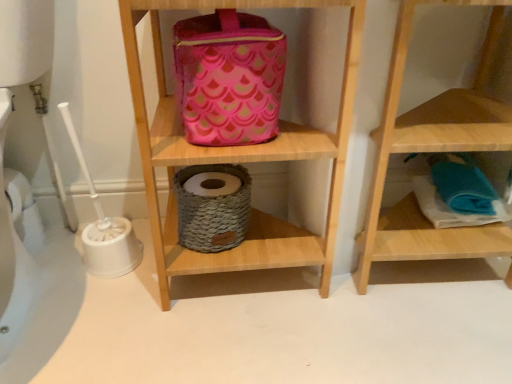
Where is `pink fabric pouch at upper center`? pink fabric pouch at upper center is located at coordinates (229, 78).

Image resolution: width=512 pixels, height=384 pixels. Identify the location of pink fabric bag at upper center, the 2th shelf viewed from the right. (237, 156).

In the scene shown: What is the approximate width of pink fabric bag at upper center, the 2th shelf viewed from the right?

44.73 centimeters.

Locate an element on the screen. This screenshot has height=384, width=512. wooden towel at lower right, the second shelf from the left is located at coordinates (434, 151).

Is wooden towel at lower right, the second shelf from the left, next to pink fabric pouch at upper center and touching it?

No, wooden towel at lower right, the second shelf from the left, is not with pink fabric pouch at upper center.

Which object is thinner, wooden towel at lower right, acting as the first shelf starting from the right, or pink fabric pouch at upper center?

Thinner between the two is pink fabric pouch at upper center.

From a real-world perspective, is wooden towel at lower right, acting as the first shelf starting from the right, over pink fabric pouch at upper center?

No, from a real-world perspective, wooden towel at lower right, acting as the first shelf starting from the right, is not over pink fabric pouch at upper center

Between wooden towel at lower right, acting as the first shelf starting from the right, and pink fabric pouch at upper center, which one has smaller size?

pink fabric pouch at upper center.

The width and height of the screenshot is (512, 384). In order to click on pouch lying on the left of wooden towel at lower right, acting as the first shelf starting from the right in this screenshot , I will do `click(229, 78)`.

From the image's perspective, between pink fabric pouch at upper center and wooden towel at lower right, the second shelf from the left, which one is located above?

From the image's view, pink fabric pouch at upper center is above.

Does pink fabric pouch at upper center touch wooden towel at lower right, acting as the first shelf starting from the right?

pink fabric pouch at upper center is not next to wooden towel at lower right, acting as the first shelf starting from the right, and they're not touching.

Between point (242, 18) and point (464, 112), which one is positioned in front?

The point (242, 18) is more forward.

Is pink fabric pouch at upper center not within pink fabric bag at upper center, arranged as the 1th shelf when viewed from the left?

Actually, pink fabric pouch at upper center is within pink fabric bag at upper center, arranged as the 1th shelf when viewed from the left.

How many degrees apart are the facing directions of pink fabric pouch at upper center and pink fabric bag at upper center, arranged as the 1th shelf when viewed from the left?

They differ by 0.455 degrees in their facing directions.

Is pink fabric pouch at upper center shorter than pink fabric bag at upper center, the 2th shelf viewed from the right?

Indeed, pink fabric pouch at upper center has a lesser height compared to pink fabric bag at upper center, the 2th shelf viewed from the right.

Is wooden towel at lower right, the second shelf from the left, positioned far away from pink fabric bag at upper center, the 2th shelf viewed from the right?

Actually, wooden towel at lower right, the second shelf from the left, and pink fabric bag at upper center, the 2th shelf viewed from the right, are a little close together.

Considering the positions of point (497, 253) and point (344, 0), is point (497, 253) closer or farther from the camera than point (344, 0)?

Point (497, 253) is positioned farther from the camera compared to point (344, 0).

From a real-world perspective, is wooden towel at lower right, the second shelf from the left, on top of pink fabric bag at upper center, the 2th shelf viewed from the right?

No, from a real-world perspective, wooden towel at lower right, the second shelf from the left, is not on top of pink fabric bag at upper center, the 2th shelf viewed from the right.

Considering the positions of objects wooden towel at lower right, the second shelf from the left, and pink fabric bag at upper center, the 2th shelf viewed from the right, in the image provided, who is more to the left, wooden towel at lower right, the second shelf from the left, or pink fabric bag at upper center, the 2th shelf viewed from the right,?

Positioned to the left is pink fabric bag at upper center, the 2th shelf viewed from the right.

Between pink fabric bag at upper center, arranged as the 1th shelf when viewed from the left, and wooden towel at lower right, acting as the first shelf starting from the right, which one has larger width?

Wider between the two is pink fabric bag at upper center, arranged as the 1th shelf when viewed from the left.

Can you confirm if pink fabric bag at upper center, the 2th shelf viewed from the right, is shorter than wooden towel at lower right, the second shelf from the left?

Incorrect, the height of pink fabric bag at upper center, the 2th shelf viewed from the right, does not fall short of that of wooden towel at lower right, the second shelf from the left.

Does pink fabric bag at upper center, arranged as the 1th shelf when viewed from the left, lie behind wooden towel at lower right, the second shelf from the left?

No, the depth of pink fabric bag at upper center, arranged as the 1th shelf when viewed from the left, is less than that of wooden towel at lower right, the second shelf from the left.

Is pink fabric bag at upper center, the 2th shelf viewed from the right, smaller than wooden towel at lower right, acting as the first shelf starting from the right?

Actually, pink fabric bag at upper center, the 2th shelf viewed from the right, might be larger than wooden towel at lower right, acting as the first shelf starting from the right.

Based on their positions, is pink fabric bag at upper center, arranged as the 1th shelf when viewed from the left, located to the left or right of pink fabric pouch at upper center?

pink fabric bag at upper center, arranged as the 1th shelf when viewed from the left, is positioned on pink fabric pouch at upper center's right side.

Considering the sizes of objects pink fabric bag at upper center, the 2th shelf viewed from the right, and pink fabric pouch at upper center in the image provided, who is wider, pink fabric bag at upper center, the 2th shelf viewed from the right, or pink fabric pouch at upper center?

pink fabric bag at upper center, the 2th shelf viewed from the right, is wider.

From the image's perspective, does pink fabric bag at upper center, arranged as the 1th shelf when viewed from the left, appear higher than pink fabric pouch at upper center?

Actually, pink fabric bag at upper center, arranged as the 1th shelf when viewed from the left, appears below pink fabric pouch at upper center in the image.

Can you confirm if pink fabric bag at upper center, arranged as the 1th shelf when viewed from the left, is smaller than pink fabric pouch at upper center?

No, pink fabric bag at upper center, arranged as the 1th shelf when viewed from the left, is not smaller than pink fabric pouch at upper center.

Find the location of a particular element. The height and width of the screenshot is (384, 512). pouch above the wooden towel at lower right, acting as the first shelf starting from the right (from the image's perspective) is located at coordinates (229, 78).

I want to click on shelf that is the 1st object located in front of the pink fabric pouch at upper center, so click(x=434, y=151).

When comparing their distances from pink fabric bag at upper center, arranged as the 1th shelf when viewed from the left, does pink fabric pouch at upper center or wooden towel at lower right, acting as the first shelf starting from the right, seem further?

Based on the image, wooden towel at lower right, acting as the first shelf starting from the right, appears to be further to pink fabric bag at upper center, arranged as the 1th shelf when viewed from the left.

Which object lies further to the anchor point pink fabric pouch at upper center, wooden towel at lower right, acting as the first shelf starting from the right, or pink fabric bag at upper center, arranged as the 1th shelf when viewed from the left?

wooden towel at lower right, acting as the first shelf starting from the right, is positioned further to the anchor pink fabric pouch at upper center.

Looking at the image, which one is located closer to wooden towel at lower right, acting as the first shelf starting from the right, pink fabric pouch at upper center or pink fabric bag at upper center, arranged as the 1th shelf when viewed from the left?

pink fabric bag at upper center, arranged as the 1th shelf when viewed from the left.

Estimate the real-world distances between objects in this image. Which object is closer to pink fabric pouch at upper center, pink fabric bag at upper center, the 2th shelf viewed from the right, or wooden towel at lower right, acting as the first shelf starting from the right?

pink fabric bag at upper center, the 2th shelf viewed from the right, is closer to pink fabric pouch at upper center.

Considering their positions, is pink fabric bag at upper center, arranged as the 1th shelf when viewed from the left, positioned closer to wooden towel at lower right, acting as the first shelf starting from the right, than pink fabric pouch at upper center?

Among the two, pink fabric bag at upper center, arranged as the 1th shelf when viewed from the left, is located nearer to wooden towel at lower right, acting as the first shelf starting from the right.

Considering their positions, is wooden towel at lower right, acting as the first shelf starting from the right, positioned closer to pink fabric bag at upper center, the 2th shelf viewed from the right, than pink fabric pouch at upper center?

Among the two, pink fabric pouch at upper center is located nearer to pink fabric bag at upper center, the 2th shelf viewed from the right.

Identify the location of shelf between pink fabric pouch at upper center and wooden towel at lower right, the second shelf from the left. (237, 156).